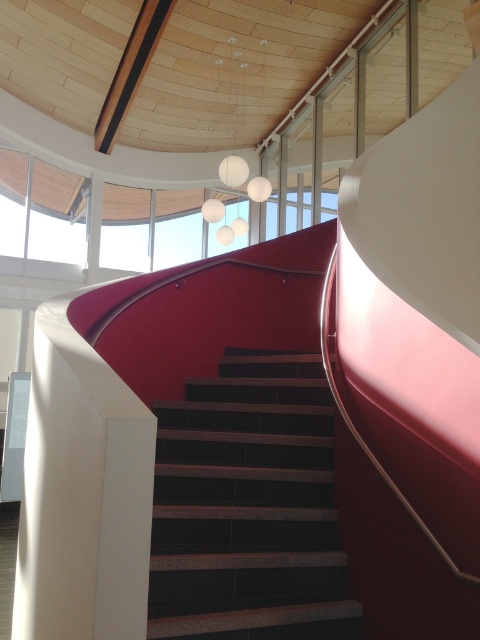
How much distance is there between dark brown textured stairs at center and clear glass window at upper left?

dark brown textured stairs at center is 6.82 meters from clear glass window at upper left.

You are a GUI agent. You are given a task and a screenshot of the screen. Output one action in this format:
    pyautogui.click(x=<x>, y=<y>)
    Task: Click on the dark brown textured stairs at center
    
    Given the screenshot: What is the action you would take?
    pyautogui.click(x=249, y=508)

Which is behind, point (283, 552) or point (63, 196)?

The point (63, 196) is behind.

Identify the location of dark brown textured stairs at center. (249, 508).